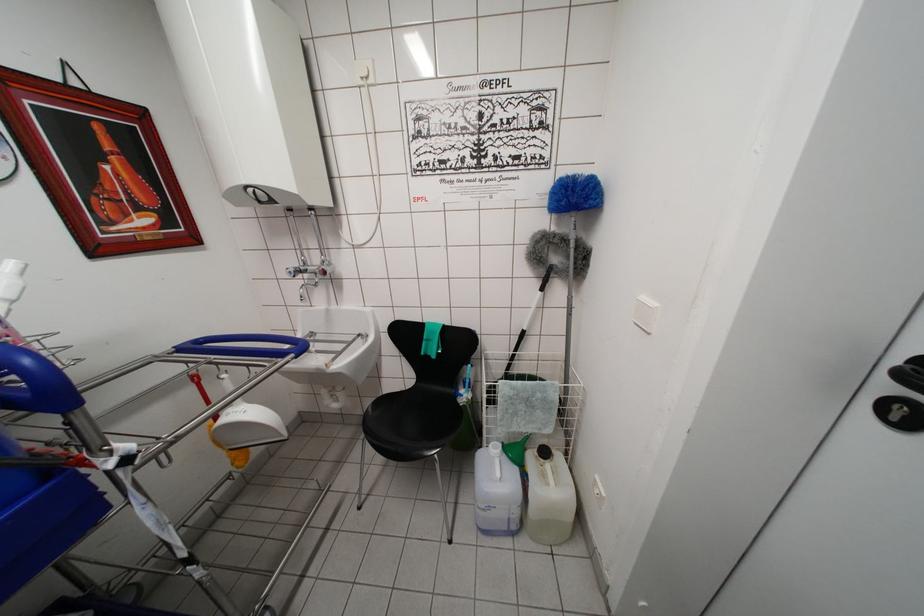
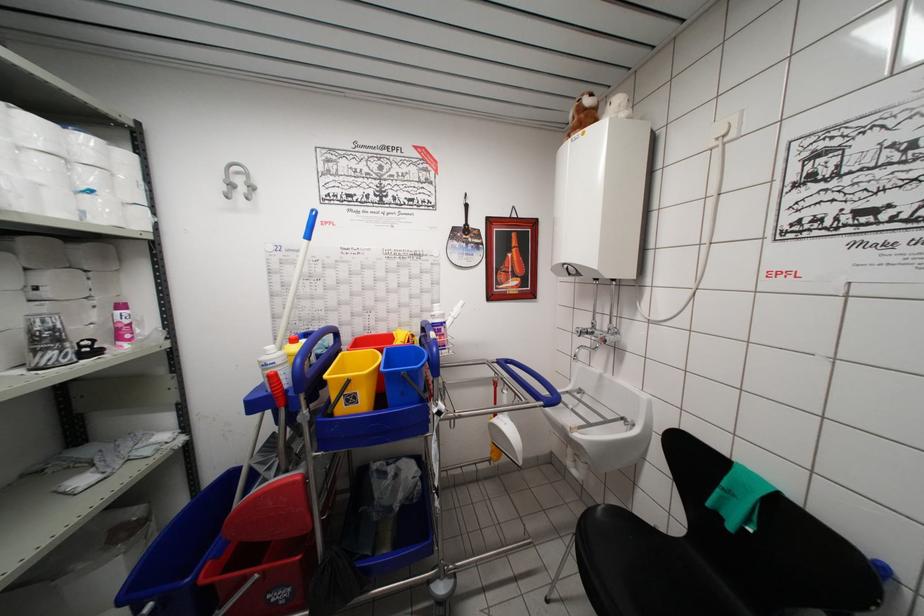
Question: The camera is either moving clockwise (left) or counter-clockwise (right) around the object. The first image is from the beginning of the video and the second image is from the end. Is the camera moving left or right when shooting the video?

Choices:
 (A) Left
 (B) Right

Answer: (B)